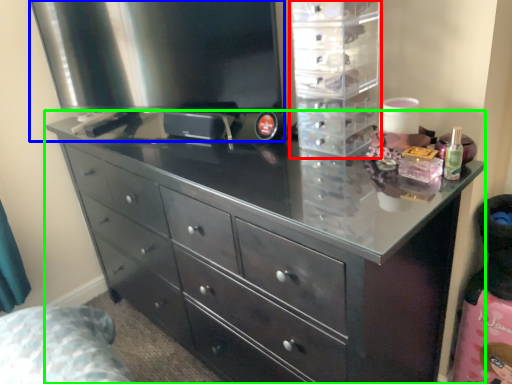
Question: Based on their relative distances, which object is farther from cabinet (highlighted by a red box)? Choose from appliance (highlighted by a blue box) and chest of drawers (highlighted by a green box).

Choices:
 (A) appliance
 (B) chest of drawers

Answer: (B)